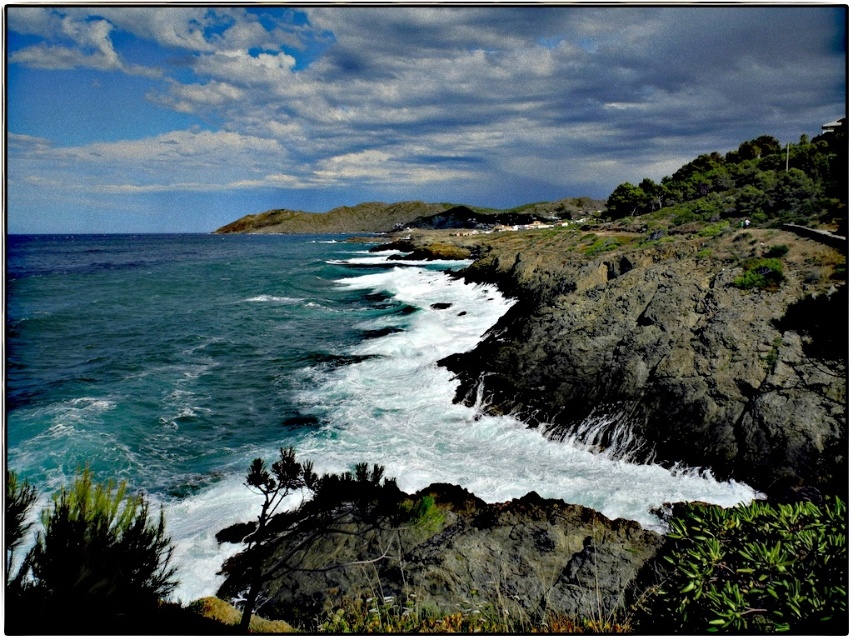
Does blue-green water at lower left have a greater width compared to dark gray rock at center?

Yes.

Which is above, blue-green water at lower left or dark gray rock at center?

blue-green water at lower left is higher up.

The image size is (853, 640). I want to click on blue-green water at lower left, so click(x=271, y=380).

Can you confirm if rocky cliff at center is positioned to the right of dark gray rock at center?

Correct, you'll find rocky cliff at center to the right of dark gray rock at center.

Can you confirm if rocky cliff at center is positioned above dark gray rock at center?

Yes, rocky cliff at center is above dark gray rock at center.

Who is more distant from viewer, (785, 268) or (461, 500)?

Point (785, 268)

Where is `rocky cliff at center`? Image resolution: width=853 pixels, height=640 pixels. rocky cliff at center is located at coordinates (672, 348).

Can you confirm if blue-green water at lower left is positioned above rocky cliff at center?

Yes, blue-green water at lower left is above rocky cliff at center.

Who is more forward, (221,257) or (782,365)?

Point (782,365) is in front.

Who is more distant from viewer, (225, 452) or (630, 353)?

Positioned behind is point (630, 353).

This screenshot has width=853, height=640. I want to click on blue-green water at lower left, so (x=271, y=380).